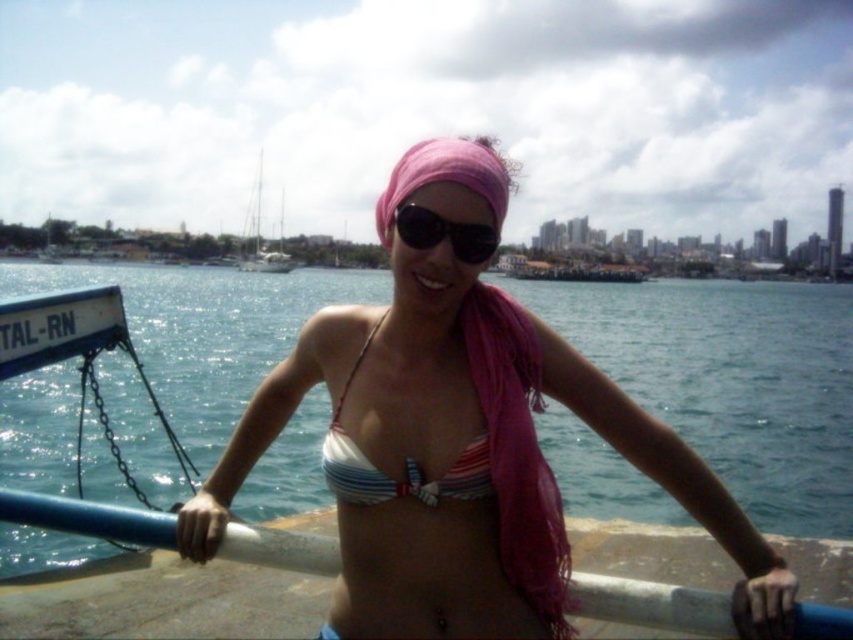
Question: Among these points, which one is nearest to the camera?

Choices:
 (A) (368, 474)
 (B) (343, 636)

Answer: (B)

Question: Does pink fabric headscarf at center come behind white matte sailboat at upper center?

Choices:
 (A) yes
 (B) no

Answer: (B)

Question: Which object is the farthest from the black reflective sunglasses at center?

Choices:
 (A) striped fabric bikini top at center
 (B) white matte sailboat at upper center
 (C) pink fabric bikini top at center

Answer: (B)

Question: Which object appears farthest from the camera in this image?

Choices:
 (A) pink fabric headscarf at center
 (B) black reflective sunglasses at center

Answer: (A)

Question: Is striped fabric bikini top at center further to the viewer compared to black reflective sunglasses at center?

Choices:
 (A) no
 (B) yes

Answer: (A)

Question: Can you confirm if striped fabric bikini top at center is positioned to the left of white matte sailboat at upper center?

Choices:
 (A) yes
 (B) no

Answer: (B)